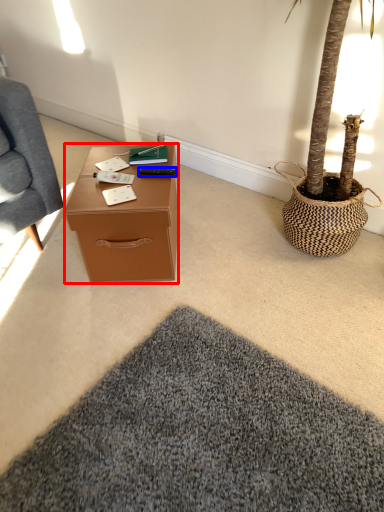
Question: Which object appears closest to the camera in this image, desk (highlighted by a red box) or remote control (highlighted by a blue box)?

Choices:
 (A) desk
 (B) remote control

Answer: (A)